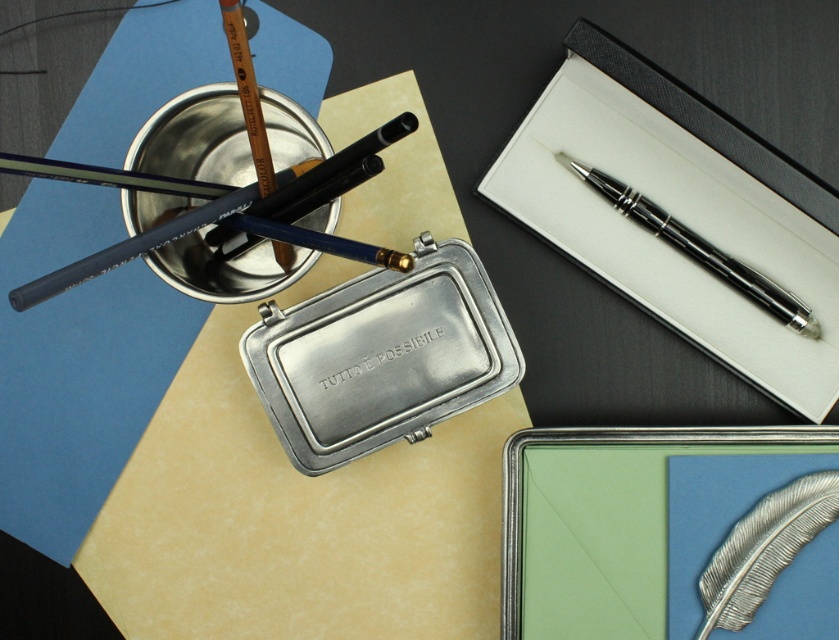
Question: Among these points, which one is nearest to the camera?

Choices:
 (A) (540, 115)
 (B) (96, 275)
 (C) (673, 232)

Answer: (B)

Question: Is matte black pencil at upper left in front of polished black pen at upper right?

Choices:
 (A) yes
 (B) no

Answer: (A)

Question: Is metallic pen at upper right positioned before polished black pen at upper right?

Choices:
 (A) no
 (B) yes

Answer: (B)

Question: Which of the following is the farthest from the observer?

Choices:
 (A) (649, 108)
 (B) (686, 252)

Answer: (B)

Question: Which object appears farthest from the camera in this image?

Choices:
 (A) metallic pen at upper right
 (B) matte black pencil at upper left

Answer: (A)

Question: Does matte black pencil at upper left have a larger size compared to polished black pen at upper right?

Choices:
 (A) no
 (B) yes

Answer: (B)